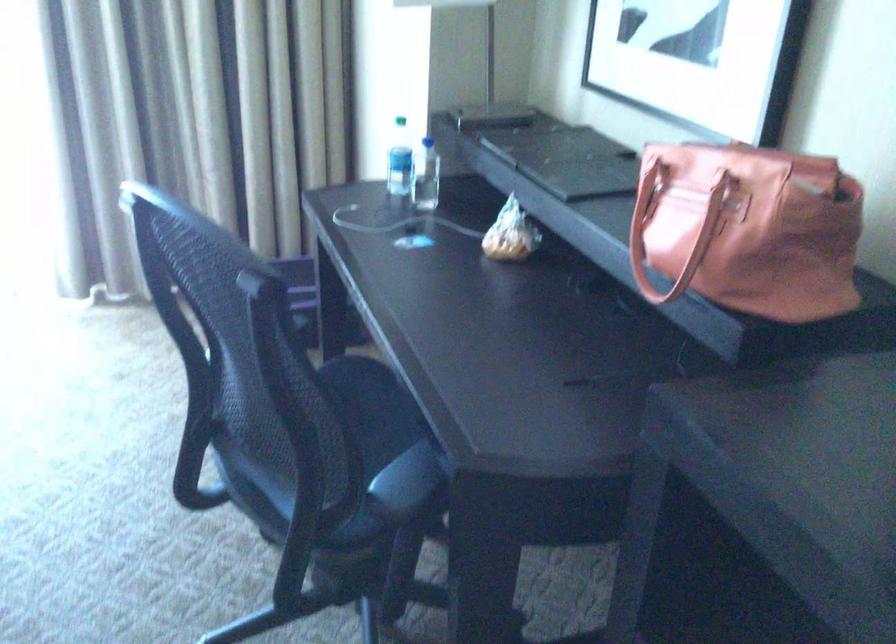
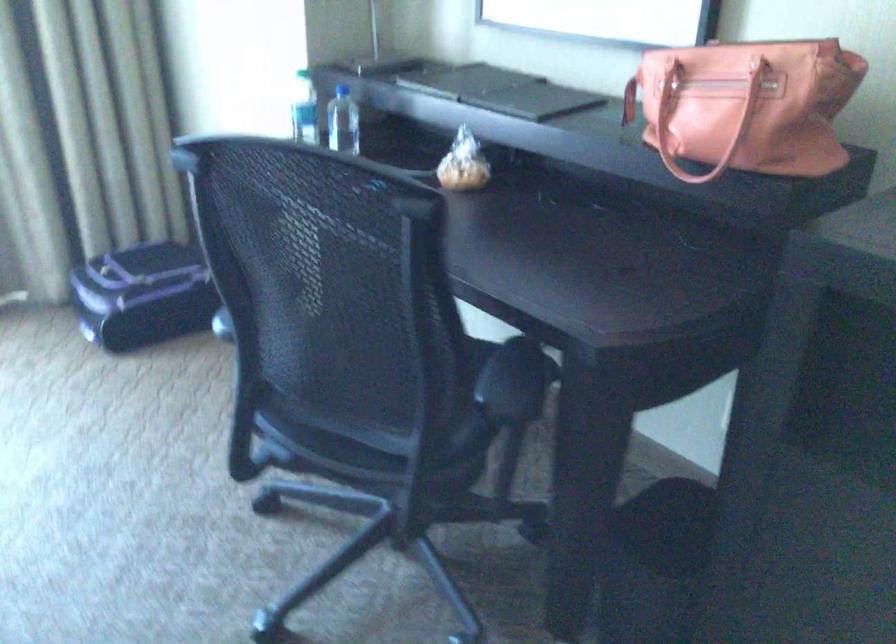
The point at [400,158] is marked in the first image. Where is the corresponding point in the second image?

(304, 109)